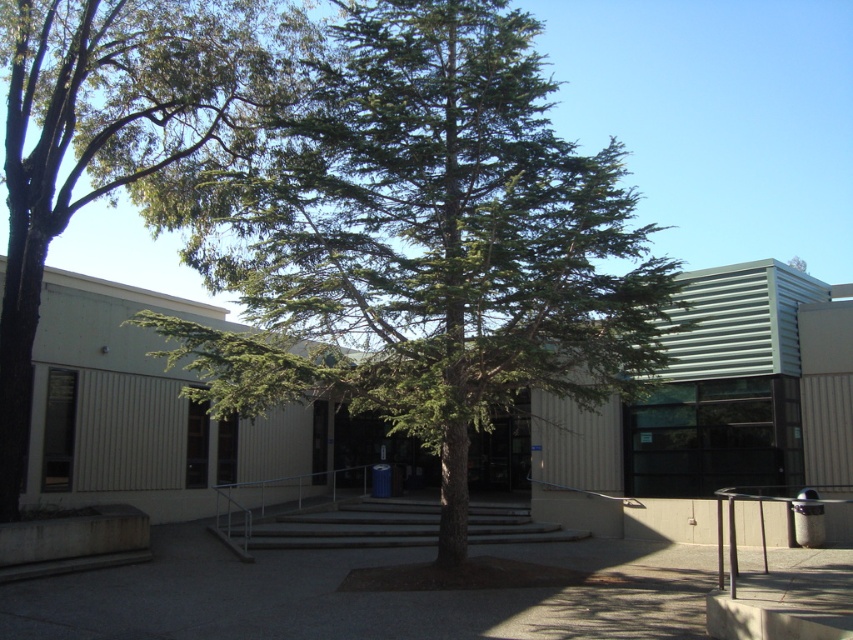
Which of these two, green leafy tree at center or gray concrete stairs at center, stands shorter?

gray concrete stairs at center

Does green leafy tree at center appear on the right side of gray concrete stairs at center?

In fact, green leafy tree at center is to the left of gray concrete stairs at center.

Who is more forward, (16, 454) or (469, 536)?

Point (16, 454) is more forward.

This screenshot has height=640, width=853. Identify the location of green leafy tree at center. (115, 131).

Does green textured tree at center have a smaller size compared to green leafy tree at center?

Incorrect, green textured tree at center is not smaller in size than green leafy tree at center.

Measure the distance between point (379, 412) and camera.

Point (379, 412) is 49.75 feet away from camera.

Is point (618, 314) more distant than point (39, 198)?

That is False.

The height and width of the screenshot is (640, 853). I want to click on green textured tree at center, so click(x=419, y=241).

Which is more to the left, green textured tree at center or gray concrete stairs at center?

gray concrete stairs at center is more to the left.

Which is behind, point (352, 310) or point (380, 534)?

The point (380, 534) is more distant.

Image resolution: width=853 pixels, height=640 pixels. I want to click on green textured tree at center, so click(419, 241).